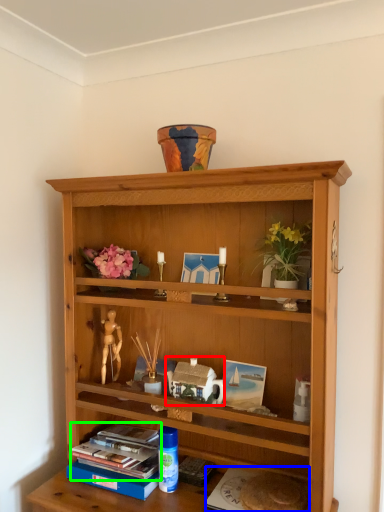
Question: Considering the real-world distances, which object is closest to stuff (highlighted by a red box)? paperback book (highlighted by a blue box) or book (highlighted by a green box).

Choices:
 (A) paperback book
 (B) book

Answer: (B)